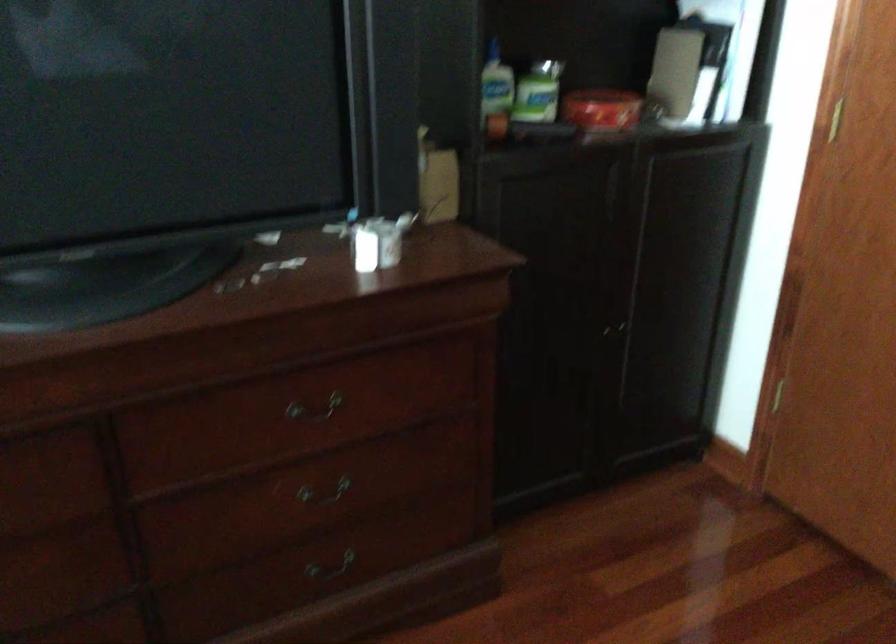
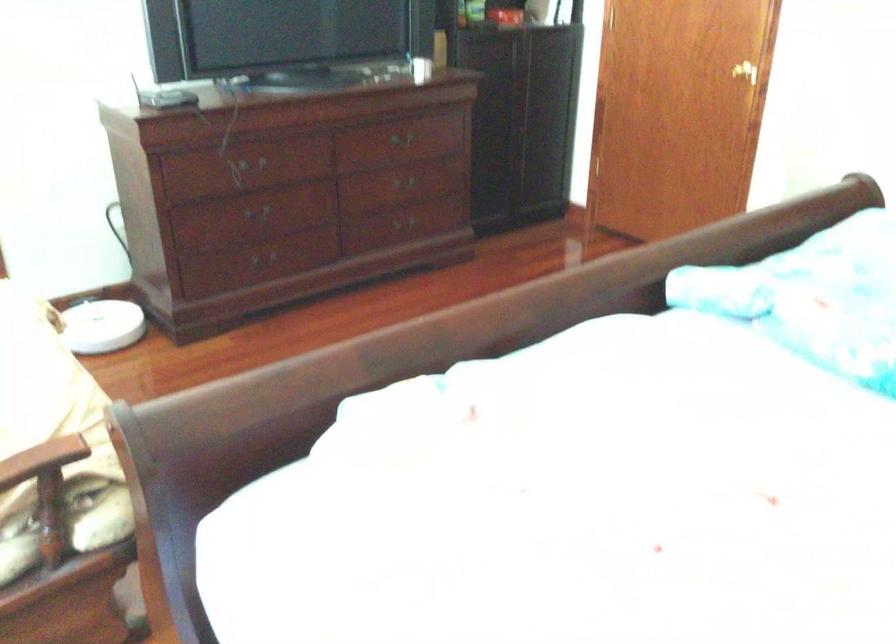
Where in the second image is the point corresponding to point (332, 408) from the first image?

(401, 138)